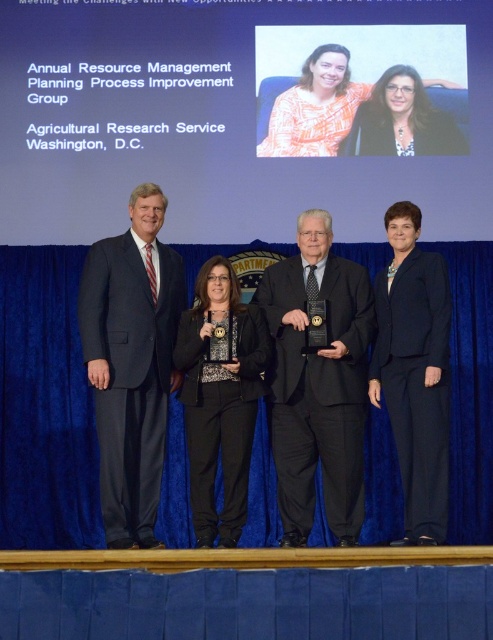
Consider the image. You are an event organizer and need to arrange name tags for the two central individuals on stage. The name tags are designed to fit over the shoulder. Given the orange printed blouse at center and the matte black blazer at center, which clothing item would require a narrower name tag to avoid it looking too bulky?

The orange printed blouse at center is thinner than the matte black blazer at center, so the name tag should be narrower for the orange printed blouse at center to maintain a proportional fit without appearing bulky.

You are a photographer standing at the back of the stage. You need to adjust your camera focus so that both the black matte suit at center and the dark blue suit at right are in focus. Which suit should you focus on first to ensure both are sharp?

You should focus on the black matte suit at center first because it is closer to you than the dark blue suit at right, which is farther away. By focusing on the closer object, the depth of field will extend to include the farther one.

You are an event photographer standing at the back of the stage. You need to take a clear photo of both the black matte suit at center and the dark blue suit at right. Which person should you focus on first to ensure both are in focus?

You should focus on the black matte suit at center first because it is closer to you than the dark blue suit at right, so focusing on the closer one first will help ensure both are in focus.